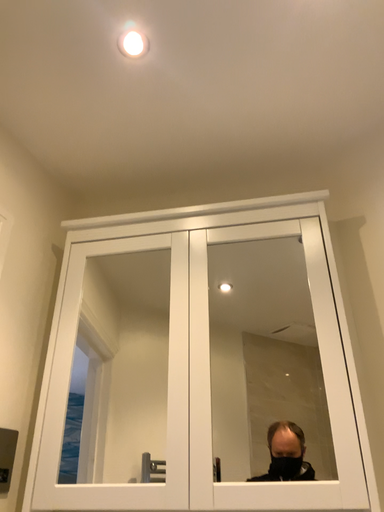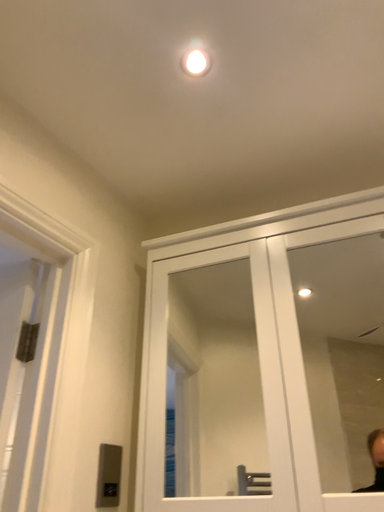
Question: Which way did the camera rotate in the video?

Choices:
 (A) rotated left
 (B) rotated right

Answer: (A)